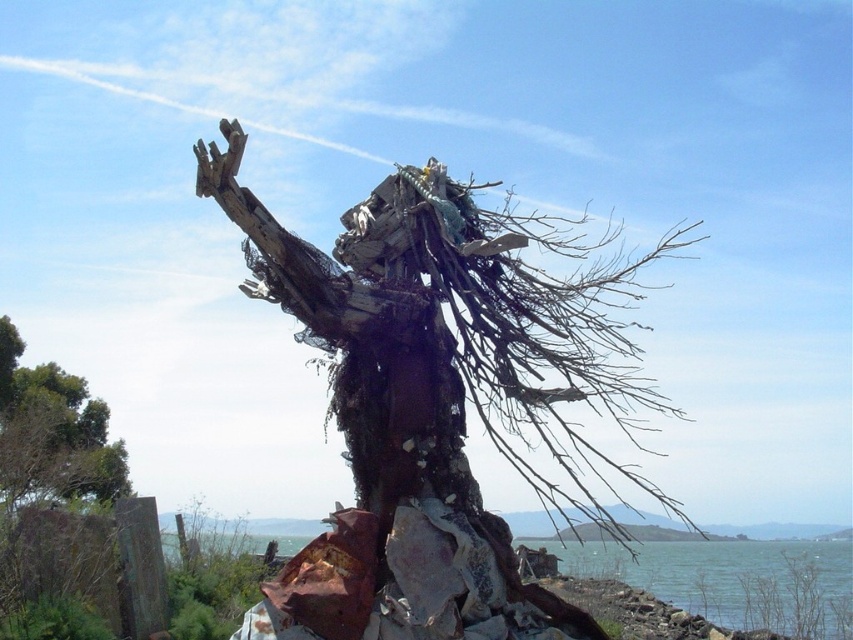
Between rusty metal sculpture at center and blue water at lower center, which one appears on the right side from the viewer's perspective?

Positioned to the right is blue water at lower center.

At what (x,y) coordinates should I click in order to perform the action: click on rusty metal sculpture at center. Please return your answer as a coordinate pair (x, y). This screenshot has width=853, height=640. Looking at the image, I should click on (436, 400).

I want to click on rusty metal sculpture at center, so click(436, 400).